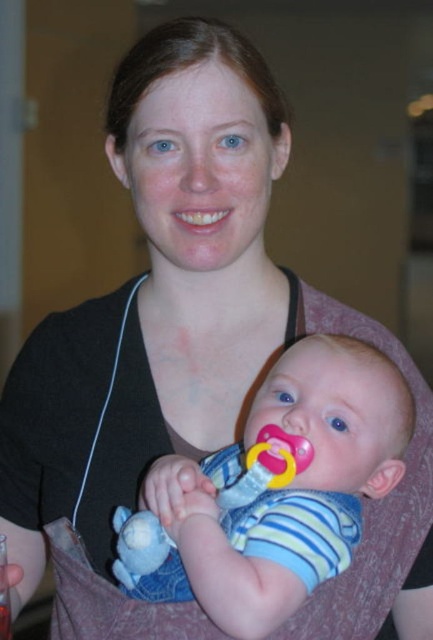
You are a photographer trying to capture a closeup of the baby in the carrier. The camera is positioned at a certain distance from the point where the baby is located, which is marked as point (x=336, y=500). If the recommended minimum distance for a clear closeup is 25 inches, will you be able to take the photo without moving the camera?

The distance between the camera and point (x=336, y=500) is 27.72 inches, which is greater than the recommended minimum of 25 inches. Therefore, you can take the photo without moving the camera as the distance is sufficient for a clear closeup.

Based on the scene description, can you determine which object is closer to the viewer between the striped fabric baby at center and the pink rubber pacifier at center?

The striped fabric baby at center is in front of the pink rubber pacifier at center, so the striped fabric baby at center is closer to the viewer.

You are a photographer adjusting your camera to focus on two points in the image. The first point is point (367, 483) and the second point is point (262, 442). Which point is closer to the camera?

Point (367, 483) is further to the camera than point (262, 442), so the second point is closer to the camera.